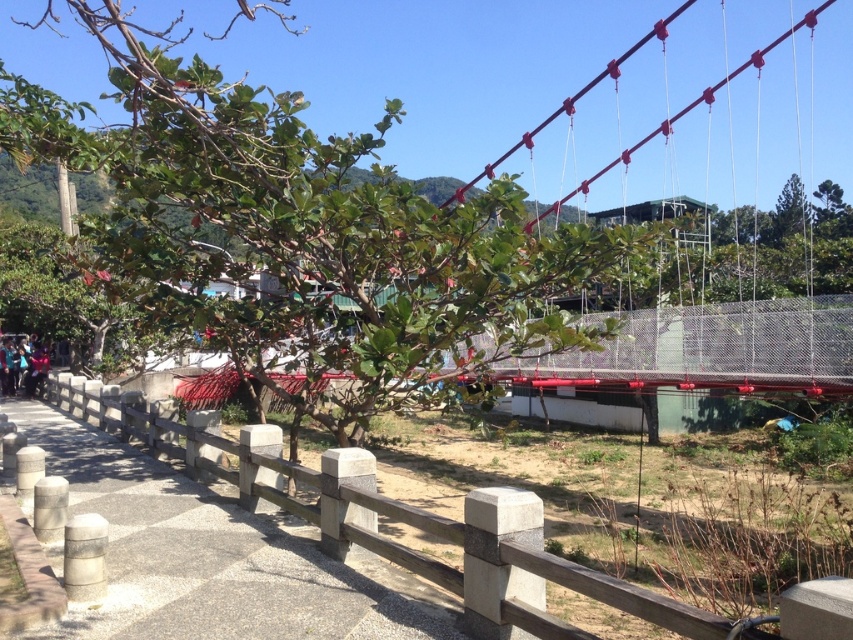
You are standing at the start of the paved pathway bordered by the low stone fence. You want to walk towards the green leafy tree at center. How far will you have to walk to reach it?

The green leafy tree at center is 13.49 feet from the viewer, so you will have to walk 13.49 feet to reach it.

You are a hiker standing on the paved pathway and want to reach the suspension bridge. You see the green leafy tree at center and the gray concrete fence at center. Which object is closer to the bridge?

The gray concrete fence at center is closer to the bridge because the green leafy tree at center is positioned on the right side of the gray concrete fence at center, meaning the fence is between the tree and the bridge.